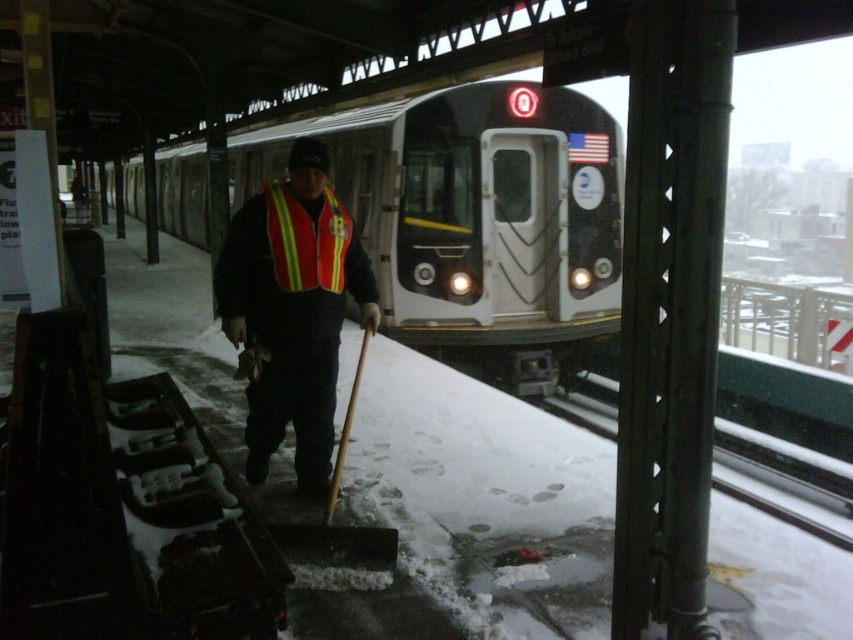
How distant is matte black train at center from reflective orange vest at center?

22.81 feet

Is matte black train at center smaller than reflective orange vest at center?

No, matte black train at center is not smaller than reflective orange vest at center.

Between point (488, 195) and point (326, 193), which one is positioned in front?

Point (326, 193) is more forward.

Locate an element on the screen. matte black train at center is located at coordinates (476, 220).

Which of these two, matte black train at center or reflective fabric safety vest at center, stands taller?

matte black train at center is taller.

Is matte black train at center further to camera compared to reflective fabric safety vest at center?

Yes, matte black train at center is further from the viewer.

Is point (463, 284) farther from camera compared to point (305, 257)?

Yes.

Locate an element on the screen. matte black train at center is located at coordinates (476, 220).

Is reflective orange vest at center bigger than metal at right?

Indeed, reflective orange vest at center has a larger size compared to metal at right.

Is the position of reflective orange vest at center more distant than that of metal at right?

No, it is in front of metal at right.

Is point (335, 221) positioned in front of point (772, 508)?

That is True.

Find the location of a particular element. The image size is (853, 640). reflective orange vest at center is located at coordinates (292, 310).